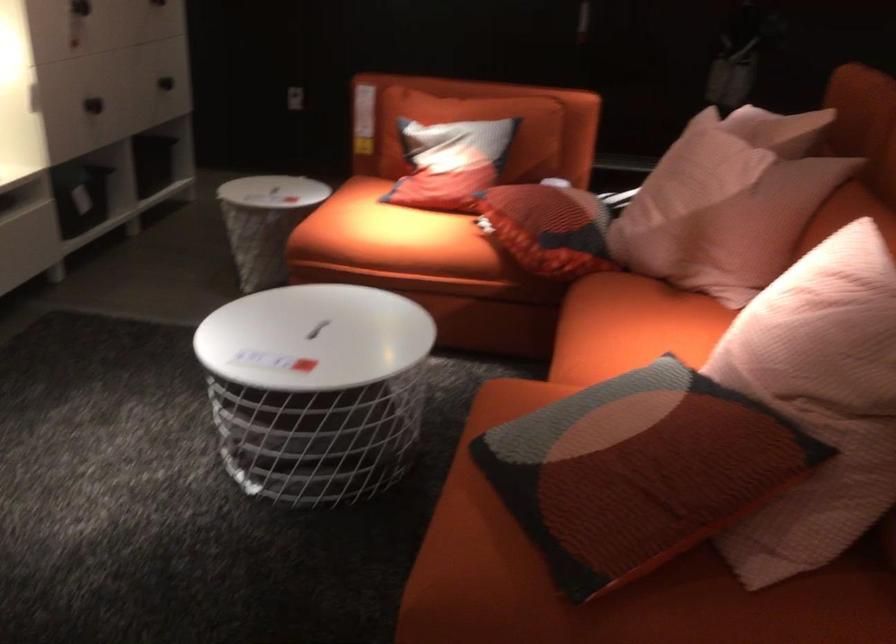
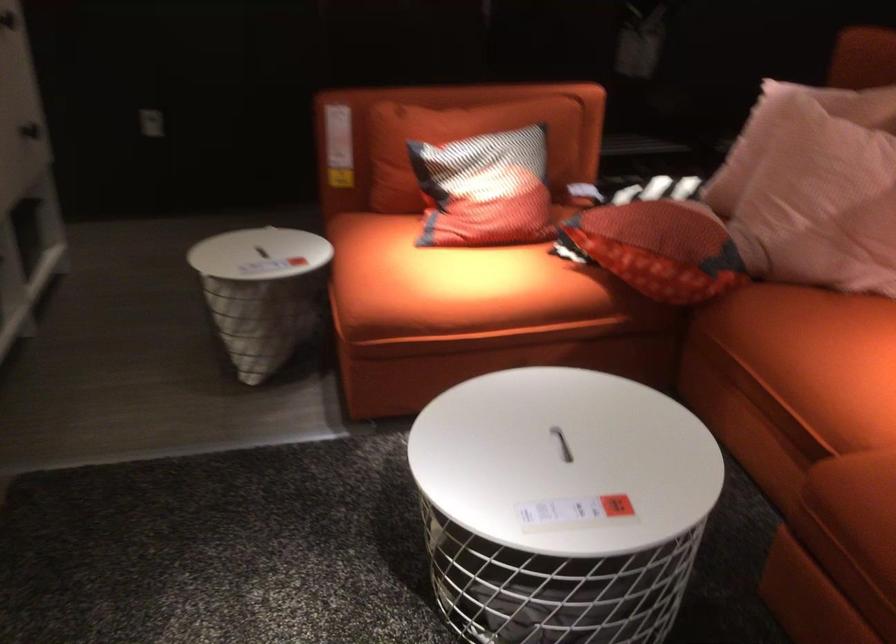
In the second image, find the point that corresponds to [339,339] in the first image.

(562, 444)